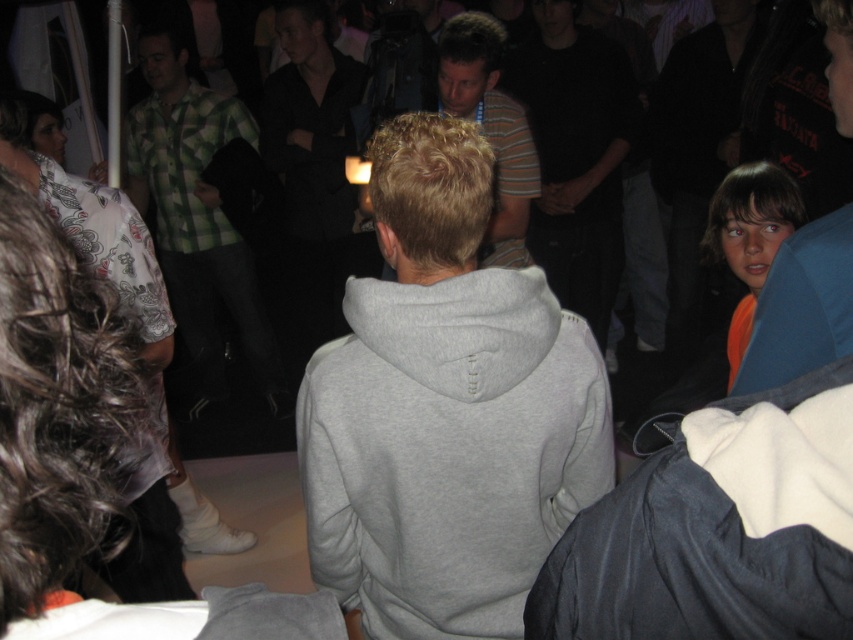
Question: Which point is farther from the camera taking this photo?

Choices:
 (A) (845, 134)
 (B) (447, 32)
 (C) (720, 182)

Answer: (B)

Question: Is dark gray hoodie at center to the right of orange fabric shirt at upper right from the viewer's perspective?

Choices:
 (A) yes
 (B) no

Answer: (A)

Question: Which object appears closest to the camera in this image?

Choices:
 (A) gray hoodie at center
 (B) green plaid shirt at left
 (C) orange fabric at right

Answer: (A)

Question: Does green plaid shirt at left have a larger size compared to dark gray hoodie at center?

Choices:
 (A) yes
 (B) no

Answer: (A)

Question: Which point appears closest to the camera in this image?

Choices:
 (A) (521, 196)
 (B) (575, 77)

Answer: (A)

Question: Is dark gray hoodie at center positioned in front of orange fabric at right?

Choices:
 (A) yes
 (B) no

Answer: (B)